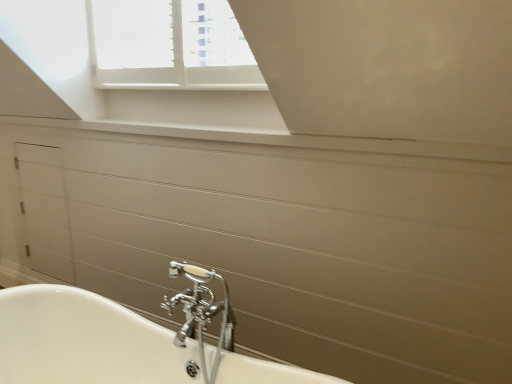
The height and width of the screenshot is (384, 512). Describe the element at coordinates (44, 210) in the screenshot. I see `white glossy drawer at left` at that location.

This screenshot has width=512, height=384. I want to click on white glossy drawer at left, so click(x=44, y=210).

Describe the element at coordinates (201, 315) in the screenshot. This screenshot has width=512, height=384. I see `chrome metallic faucet at lower center` at that location.

Measure the distance between point [193,270] and camera.

Point [193,270] is 4.48 feet from camera.

Find the location of a particular element. The image size is (512, 384). chrome metallic faucet at lower center is located at coordinates (201, 315).

What are the coordinates of `white glossy drawer at left` in the screenshot? It's located at (44, 210).

Which object is positioned more to the left, chrome metallic faucet at lower center or white glossy drawer at left?

white glossy drawer at left.

Which is in front, chrome metallic faucet at lower center or white glossy drawer at left?

Positioned in front is chrome metallic faucet at lower center.

Is point (173, 272) behind point (55, 233)?

No, (173, 272) is closer to viewer.

From the image's perspective, is chrome metallic faucet at lower center below white glossy drawer at left?

Correct, chrome metallic faucet at lower center appears lower than white glossy drawer at left in the image.

Consider the image. From a real-world perspective, is chrome metallic faucet at lower center above or below white glossy drawer at left?

Clearly, from a real-world perspective, chrome metallic faucet at lower center is below white glossy drawer at left.

In terms of width, does chrome metallic faucet at lower center look wider or thinner when compared to white glossy drawer at left?

Clearly, chrome metallic faucet at lower center has more width compared to white glossy drawer at left.

Does chrome metallic faucet at lower center have a lesser height compared to white glossy drawer at left?

Yes, chrome metallic faucet at lower center is shorter than white glossy drawer at left.

In the scene shown: Considering the sizes of objects chrome metallic faucet at lower center and white glossy drawer at left in the image provided, who is bigger, chrome metallic faucet at lower center or white glossy drawer at left?

→ Bigger between the two is white glossy drawer at left.

Is chrome metallic faucet at lower center inside or outside of white glossy drawer at left?

chrome metallic faucet at lower center exists outside the volume of white glossy drawer at left.

Is chrome metallic faucet at lower center directly adjacent to white glossy drawer at left?

No, chrome metallic faucet at lower center is not in contact with white glossy drawer at left.

Is chrome metallic faucet at lower center oriented towards white glossy drawer at left?

No, chrome metallic faucet at lower center is not facing towards white glossy drawer at left.

What's the angular difference between chrome metallic faucet at lower center and white glossy drawer at left's facing directions?

The angular difference between chrome metallic faucet at lower center and white glossy drawer at left is 1.93 degrees.

Measure the distance between chrome metallic faucet at lower center and white glossy drawer at left.

chrome metallic faucet at lower center is 5.27 feet away from white glossy drawer at left.

Locate an element on the screen. The height and width of the screenshot is (384, 512). tap in front of the white glossy drawer at left is located at coordinates (201, 315).

Is white glossy drawer at left at the left side of chrome metallic faucet at lower center?

Indeed, white glossy drawer at left is positioned on the left side of chrome metallic faucet at lower center.

Between white glossy drawer at left and chrome metallic faucet at lower center, which one is positioned in front?

Positioned in front is chrome metallic faucet at lower center.

Does point (33, 231) come in front of point (219, 277)?

No.

From the image's perspective, does white glossy drawer at left appear higher than chrome metallic faucet at lower center?

Indeed, from the image's perspective, white glossy drawer at left is shown above chrome metallic faucet at lower center.

In the scene shown: From a real-world perspective, is white glossy drawer at left positioned over chrome metallic faucet at lower center based on gravity?

Correct, in the physical world, white glossy drawer at left is higher than chrome metallic faucet at lower center.

Can you confirm if white glossy drawer at left is wider than chrome metallic faucet at lower center?

Incorrect, the width of white glossy drawer at left does not surpass that of chrome metallic faucet at lower center.

In the scene shown: Can you confirm if white glossy drawer at left is taller than chrome metallic faucet at lower center?

Yes.

Can you confirm if white glossy drawer at left is smaller than chrome metallic faucet at lower center?

No, white glossy drawer at left is not smaller than chrome metallic faucet at lower center.

Can we say white glossy drawer at left lies outside chrome metallic faucet at lower center?

Yes.

Is white glossy drawer at left far away from chrome metallic faucet at lower center?

Yes.

Is white glossy drawer at left facing away from chrome metallic faucet at lower center?

No.

How many degrees apart are the facing directions of white glossy drawer at left and chrome metallic faucet at lower center?

The angular difference between white glossy drawer at left and chrome metallic faucet at lower center is 1.93 degrees.

In the image, there is a chrome metallic faucet at lower center. At what (x,y) coordinates should I click in order to perform the action: click on drawer above it (from the image's perspective). Please return your answer as a coordinate pair (x, y). The width and height of the screenshot is (512, 384). Looking at the image, I should click on (44, 210).

The width and height of the screenshot is (512, 384). I want to click on tap that appears below the white glossy drawer at left (from a real-world perspective), so click(201, 315).

The height and width of the screenshot is (384, 512). In order to click on drawer that is above the chrome metallic faucet at lower center (from the image's perspective) in this screenshot , I will do `click(44, 210)`.